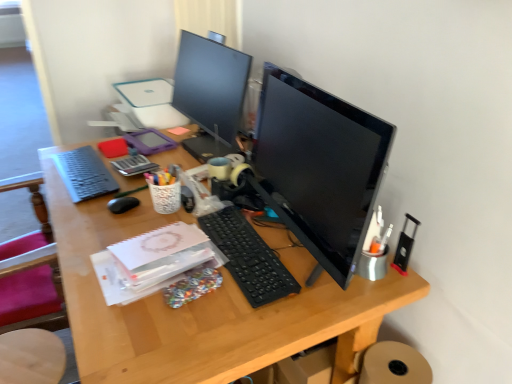
Image resolution: width=512 pixels, height=384 pixels. In order to click on vacant region above wooden seat at lower left (from a real-world perspective) in this screenshot , I will do `click(29, 362)`.